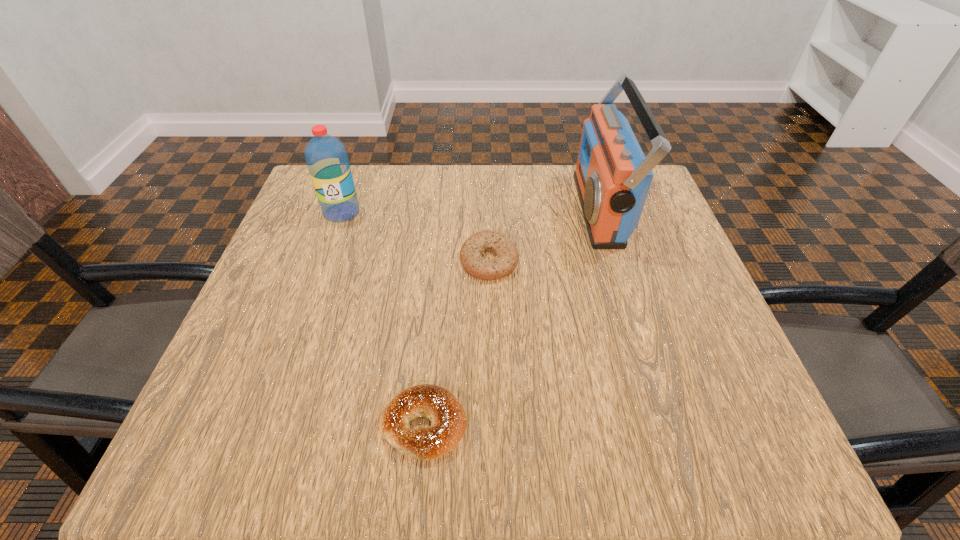
This screenshot has width=960, height=540. Identify the location of free spot between the radio receiver and the water bottle. (470, 211).

Locate an element on the screen. This screenshot has height=540, width=960. vacant space in between the water bottle and the tallest object is located at coordinates (470, 211).

I want to click on empty space that is in between the farther bagel and the nearer bagel, so click(456, 343).

At what (x,y) coordinates should I click in order to perform the action: click on free spot between the farther bagel and the third shortest object. Please return your answer as a coordinate pair (x, y). This screenshot has width=960, height=540. Looking at the image, I should click on (416, 237).

Find the location of a particular element. This screenshot has height=540, width=960. the third closest object to the third shortest object is located at coordinates point(612,176).

Locate which object is the third closest to the farther bagel. Please provide its 2D coordinates. Your answer should be formatted as a tuple, i.e. [(x, y)], where the tuple contains the x and y coordinates of a point satisfying the conditions above.

[(326, 157)]

Locate an element on the screen. This screenshot has height=540, width=960. free spot that satisfies the following two spatial constraints: 1. on the front-facing side of the radio receiver; 2. on the front label of the third shortest object is located at coordinates (601, 212).

The height and width of the screenshot is (540, 960). I want to click on free location that satisfies the following two spatial constraints: 1. on the front label of the third shortest object; 2. on the right side of the nearer bagel, so click(267, 424).

At what (x,y) coordinates should I click in order to perform the action: click on free location that satisfies the following two spatial constraints: 1. on the front label of the farther bagel; 2. on the right side of the water bottle. Please return your answer as a coordinate pair (x, y). Image resolution: width=960 pixels, height=540 pixels. Looking at the image, I should click on (324, 261).

Locate an element on the screen. This screenshot has width=960, height=540. vacant space that satisfies the following two spatial constraints: 1. on the front-facing side of the radio receiver; 2. on the front label of the third shortest object is located at coordinates (601, 212).